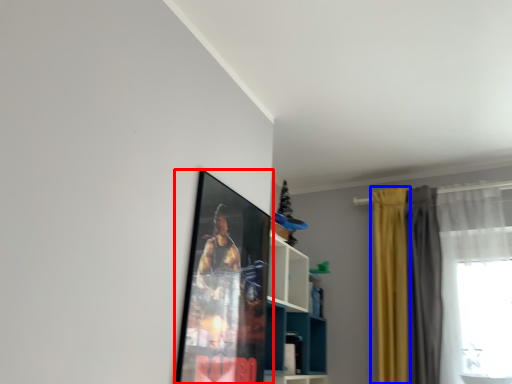
Question: Among these objects, which one is farthest to the camera, picture frame (highlighted by a red box) or curtain (highlighted by a blue box)?

Choices:
 (A) picture frame
 (B) curtain

Answer: (B)